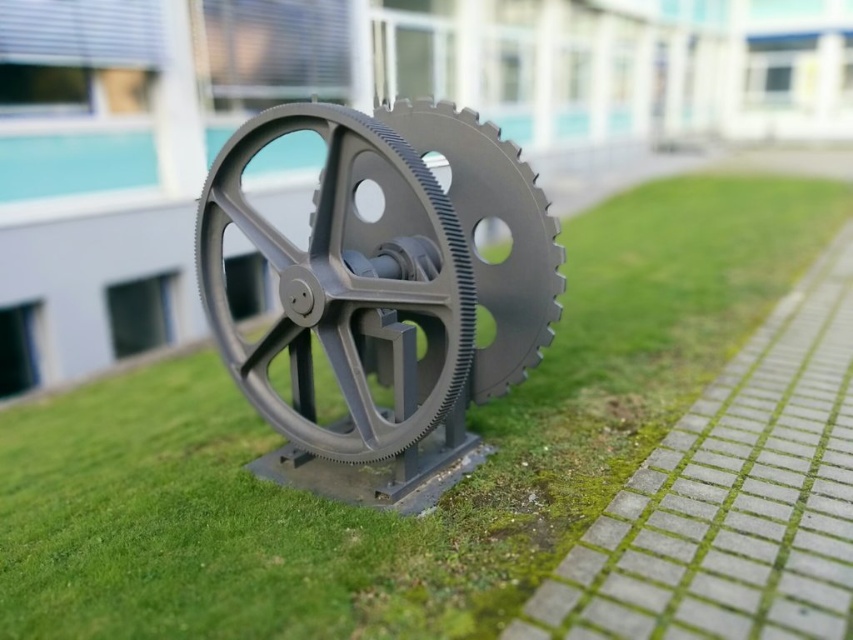
You are a maintenance worker needing to access the base of the matte gray gear at center. You see the gray concrete paving at lower right. Can you step onto the paving to reach the gear?

The gray concrete paving at lower right is located below the matte gray gear at center, so stepping onto the paving would allow you to access the base of the matte gray gear at center.